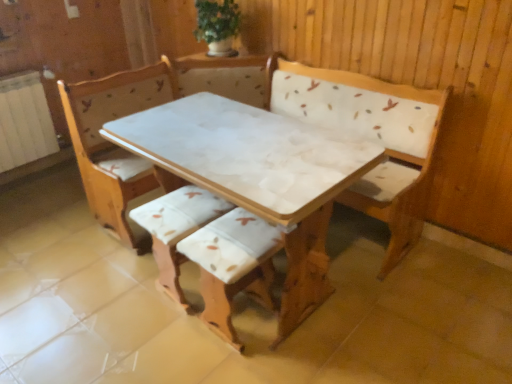
Where is `unoccupied region to the right of wooden armchair at center, which is the first armchair in right-to-left order`? unoccupied region to the right of wooden armchair at center, which is the first armchair in right-to-left order is located at coordinates (314, 337).